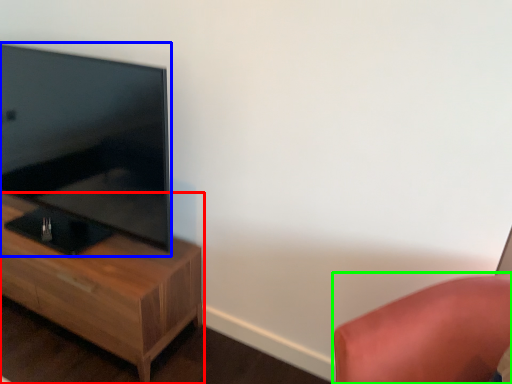
Question: Which is nearer to the nightstand (highlighted by a red box)? television (highlighted by a blue box) or furniture (highlighted by a green box).

Choices:
 (A) television
 (B) furniture

Answer: (A)